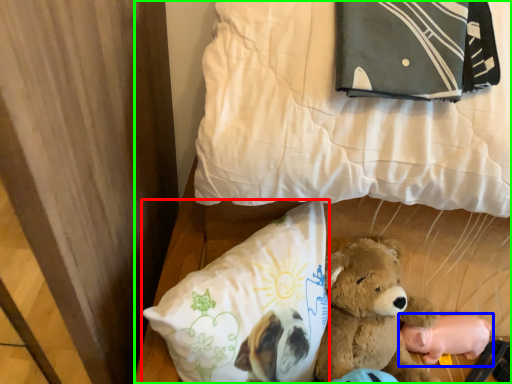
Question: Estimate the real-world distances between objects in this image. Which object is farther from pillow (highlighted by a red box), toy (highlighted by a blue box) or bed (highlighted by a green box)?

Choices:
 (A) toy
 (B) bed

Answer: (A)